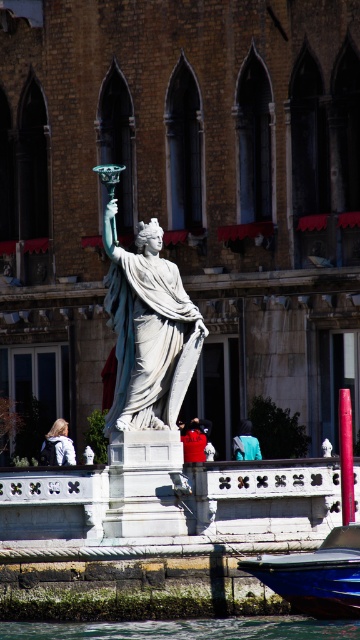
Locate an element on the screen. The width and height of the screenshot is (360, 640). clear water at lower center is located at coordinates (187, 628).

Which is more to the right, clear water at lower center or blue glossy boat at lower center?

From the viewer's perspective, blue glossy boat at lower center appears more on the right side.

Is point (322, 627) closer to camera compared to point (353, 525)?

That is True.

This screenshot has width=360, height=640. Find the location of `clear water at lower center`. clear water at lower center is located at coordinates (187, 628).

Is white marble statue at center positioned in front of clear water at lower center?

No, it is behind clear water at lower center.

You are a GUI agent. You are given a task and a screenshot of the screen. Output one action in this format:
    pyautogui.click(x=<x>, y=<y>)
    Task: Click on the white marble statue at center
    The height and width of the screenshot is (640, 360).
    Given the screenshot: What is the action you would take?
    pyautogui.click(x=146, y=324)

I want to click on white marble statue at center, so click(146, 324).

Does point (150, 237) come in front of point (326, 611)?

No, (150, 237) is further to viewer.

Who is higher up, white marble statue at center or blue glossy boat at lower center?

white marble statue at center

Locate an element on the screen. The image size is (360, 640). white marble statue at center is located at coordinates (146, 324).

In order to click on white marble statue at center in this screenshot , I will do `click(146, 324)`.